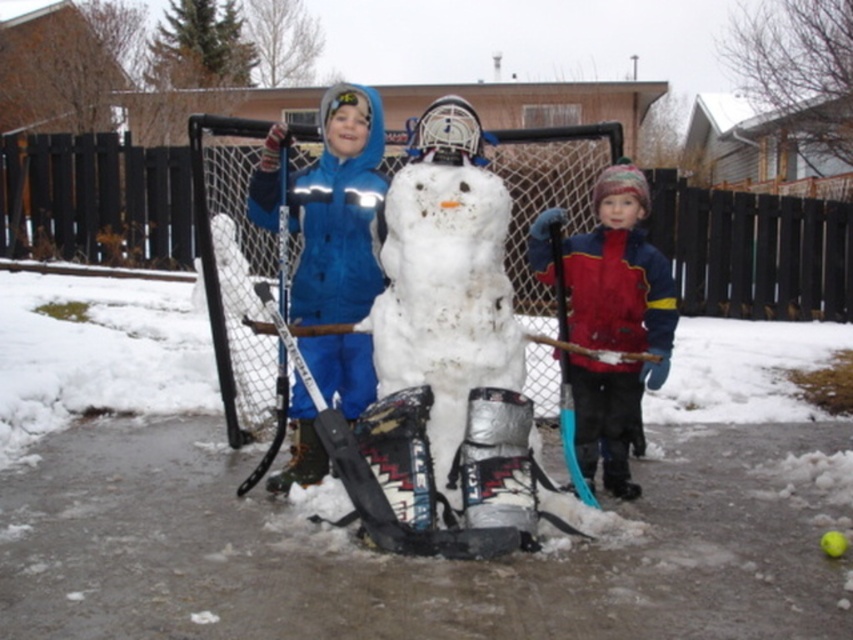
You are standing at the origin point in the winter scene. The blue fabric snowman at center is located at coordinates point (339,211). If you want to walk directly towards the snowman, which direction should you head?

The blue fabric snowman at center is located at point (339,211), so you should head northeast to reach it.

Based on the photo, you are a parent looking at the backyard scene. You see the white fluffy snow at center and the red fleece jacket at right. Which object is taller?

The red fleece jacket at right is taller than the white fluffy snow at center.